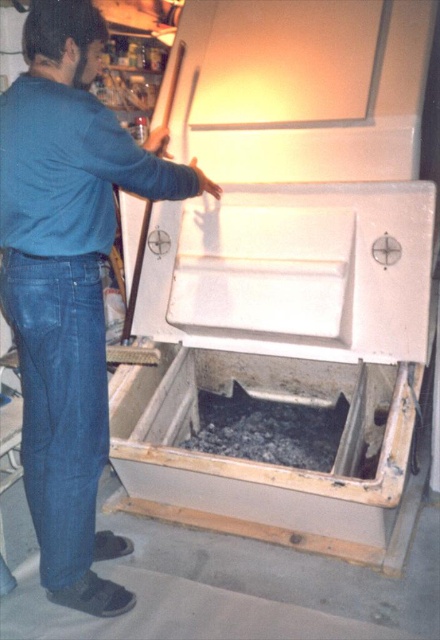
Based on the photo, is white matte washing machine at center thinner than blue denim jeans at lower left?

In fact, white matte washing machine at center might be wider than blue denim jeans at lower left.

Is white matte washing machine at center smaller than blue denim jeans at lower left?

Incorrect, white matte washing machine at center is not smaller in size than blue denim jeans at lower left.

Where is `white matte washing machine at center`? This screenshot has width=440, height=640. white matte washing machine at center is located at coordinates (289, 273).

Can you confirm if white matte washing machine at center is positioned above black gravel at lower center?

Yes.

Does white matte washing machine at center have a smaller size compared to black gravel at lower center?

No.

The height and width of the screenshot is (640, 440). What do you see at coordinates (289, 273) in the screenshot?
I see `white matte washing machine at center` at bounding box center [289, 273].

You are a GUI agent. You are given a task and a screenshot of the screen. Output one action in this format:
    pyautogui.click(x=<x>, y=<y>)
    Task: Click on the white matte washing machine at center
    The width and height of the screenshot is (440, 640).
    Given the screenshot: What is the action you would take?
    pyautogui.click(x=289, y=273)

Is blue denim jeans at lower left taller than denim at left?

Indeed, blue denim jeans at lower left has a greater height compared to denim at left.

Which is behind, point (14, 300) or point (81, 372)?

The point (81, 372) is behind.

This screenshot has width=440, height=640. What do you see at coordinates (68, 282) in the screenshot?
I see `blue denim jeans at lower left` at bounding box center [68, 282].

Where is `blue denim jeans at lower left`? The image size is (440, 640). blue denim jeans at lower left is located at coordinates (68, 282).